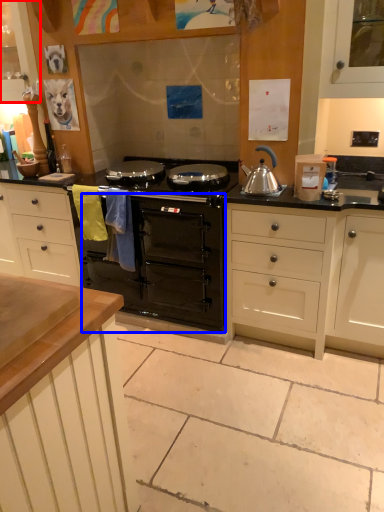
Question: Which object appears closest to the camera in this image, cabinetry (highlighted by a red box) or oven (highlighted by a blue box)?

Choices:
 (A) cabinetry
 (B) oven

Answer: (B)